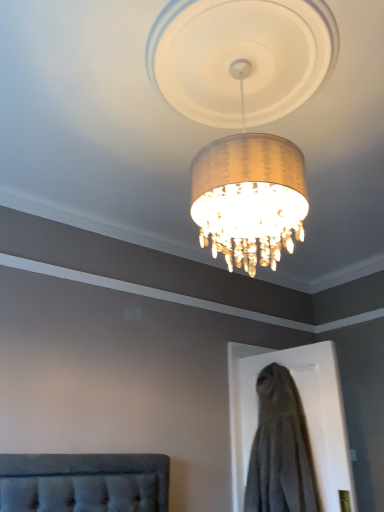
I want to click on gold textured lampshade at center, so click(x=241, y=57).

The height and width of the screenshot is (512, 384). What do you see at coordinates (241, 57) in the screenshot?
I see `gold textured lampshade at center` at bounding box center [241, 57].

This screenshot has width=384, height=512. I want to click on gray fabric dress at lower right, so click(x=280, y=449).

What do you see at coordinates (280, 449) in the screenshot? I see `gray fabric dress at lower right` at bounding box center [280, 449].

Locate an element on the screen. This screenshot has width=384, height=512. gold textured lampshade at center is located at coordinates (241, 57).

Consider the image. Can you confirm if gray fabric dress at lower right is positioned to the left of gold textured lampshade at center?

No.

Relative to gold textured lampshade at center, is gray fabric dress at lower right in front or behind?

In the image, gray fabric dress at lower right appears behind gold textured lampshade at center.

Is point (258, 444) positioned after point (238, 162)?

Yes, point (258, 444) is farther from viewer.

From the image's perspective, is gray fabric dress at lower right under gold textured lampshade at center?

Correct, gray fabric dress at lower right appears lower than gold textured lampshade at center in the image.

From a real-world perspective, is gray fabric dress at lower right physically below gold textured lampshade at center?

Yes, from a real-world perspective, gray fabric dress at lower right is beneath gold textured lampshade at center.

Which object is thinner, gray fabric dress at lower right or gold textured lampshade at center?

gray fabric dress at lower right.

In the scene shown: Considering the sizes of objects gray fabric dress at lower right and gold textured lampshade at center in the image provided, who is shorter, gray fabric dress at lower right or gold textured lampshade at center?

With less height is gold textured lampshade at center.

From the picture: Considering the relative sizes of gray fabric dress at lower right and gold textured lampshade at center in the image provided, is gray fabric dress at lower right smaller than gold textured lampshade at center?

Correct, gray fabric dress at lower right occupies less space than gold textured lampshade at center.

Is gray fabric dress at lower right inside or outside of gold textured lampshade at center?

gray fabric dress at lower right exists outside the volume of gold textured lampshade at center.

Is gray fabric dress at lower right beside gold textured lampshade at center?

gray fabric dress at lower right and gold textured lampshade at center are clearly separated.

Is gray fabric dress at lower right facing away from gold textured lampshade at center?

gray fabric dress at lower right does not have its back to gold textured lampshade at center.

How far apart are gray fabric dress at lower right and gold textured lampshade at center?

gray fabric dress at lower right is 1.91 meters away from gold textured lampshade at center.

You are a GUI agent. You are given a task and a screenshot of the screen. Output one action in this format:
    pyautogui.click(x=<x>, y=<y>)
    Task: Click on the lamp located above the gray fabric dress at lower right (from a real-world perspective)
    
    Given the screenshot: What is the action you would take?
    pyautogui.click(x=241, y=57)

Is gold textured lampshade at center to the left or to the right of gray fabric dress at lower right in the image?

gold textured lampshade at center is positioned on gray fabric dress at lower right's left side.

Looking at this image, between gold textured lampshade at center and gray fabric dress at lower right, which one is positioned behind?

gray fabric dress at lower right is more distant.

Does point (261, 54) appear closer or farther from the camera than point (289, 470)?

Point (261, 54) is positioned closer to the camera compared to point (289, 470).

From the image's perspective, which object appears higher, gold textured lampshade at center or gray fabric dress at lower right?

gold textured lampshade at center, from the image's perspective.

From the picture: From a real-world perspective, is gold textured lampshade at center located higher than gray fabric dress at lower right?

Indeed, from a real-world perspective, gold textured lampshade at center stands above gray fabric dress at lower right.

Based on the photo, between gold textured lampshade at center and gray fabric dress at lower right, which one has smaller width?

gray fabric dress at lower right.

Considering the sizes of objects gold textured lampshade at center and gray fabric dress at lower right in the image provided, who is shorter, gold textured lampshade at center or gray fabric dress at lower right?

gold textured lampshade at center.

Which of these two, gold textured lampshade at center or gray fabric dress at lower right, is smaller?

With smaller size is gray fabric dress at lower right.

In the scene shown: Can we say gold textured lampshade at center lies outside gray fabric dress at lower right?

gold textured lampshade at center lies outside gray fabric dress at lower right's area.

Is gold textured lampshade at center next to gray fabric dress at lower right and touching it?

gold textured lampshade at center and gray fabric dress at lower right are clearly separated.

Could you tell me if gold textured lampshade at center is facing gray fabric dress at lower right?

No.

Based on the photo, how many degrees apart are the facing directions of gold textured lampshade at center and gray fabric dress at lower right?

There is a 95.4-degree angle between the facing directions of gold textured lampshade at center and gray fabric dress at lower right.

Locate an element on the screen. dress that appears on the right of gold textured lampshade at center is located at coordinates (280, 449).

Locate an element on the screen. The height and width of the screenshot is (512, 384). lamp located in front of the gray fabric dress at lower right is located at coordinates (241, 57).

Image resolution: width=384 pixels, height=512 pixels. I want to click on lamp lying on the left of gray fabric dress at lower right, so click(241, 57).